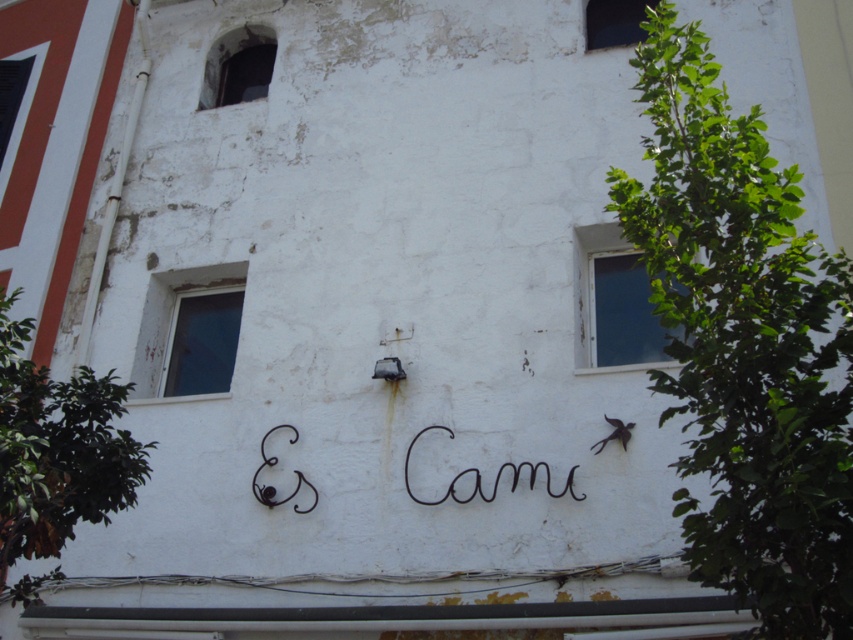
Is white painted wood window at upper left positioned in front of dark glass window at upper left?

Yes, white painted wood window at upper left is closer to the viewer.

Is white painted wood window at upper left taller than dark glass window at upper left?

Yes, white painted wood window at upper left is taller than dark glass window at upper left.

Who is more forward, (228,275) or (253,35)?

Point (228,275) is in front.

You are a GUI agent. You are given a task and a screenshot of the screen. Output one action in this format:
    pyautogui.click(x=<x>, y=<y>)
    Task: Click on the white painted wood window at upper left
    
    Given the screenshot: What is the action you would take?
    pyautogui.click(x=189, y=332)

Based on the photo, who is more forward, (x=216, y=104) or (x=624, y=17)?

Point (x=624, y=17) is in front.

Does dark glass window at upper left appear on the right side of transparent glass window at upper center?

Incorrect, dark glass window at upper left is not on the right side of transparent glass window at upper center.

Find the location of `dark glass window at upper left`. dark glass window at upper left is located at coordinates (238, 67).

Does transparent glass window at upper center lie in front of black wire writing at center?

No.

Between transparent glass window at upper center and black wire writing at center, which one is positioned higher?

transparent glass window at upper center is above.

Identify the location of transparent glass window at upper center. This screenshot has width=853, height=640. (614, 20).